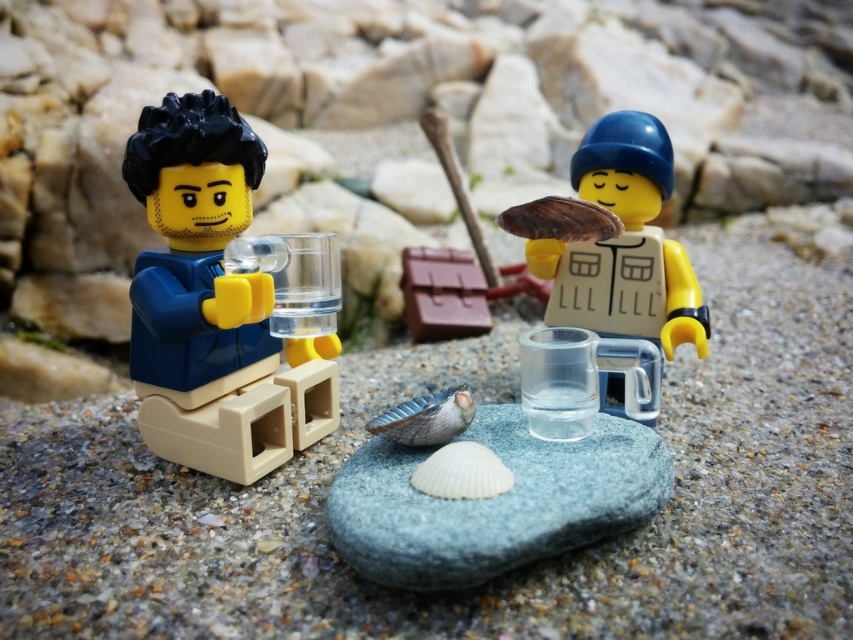
You are a LEGO minifigure trying to determine which object is bigger between the matte blue shirt at left and the smooth gray rock at center. Based on the scene, which one is larger?

The matte blue shirt at left is larger in size than the smooth gray rock at center.

You are a LEGO minifigure trying to reach the translucent plastic mug at center without stepping on the smooth gray rock at center. Can you walk directly between them?

The smooth gray rock at center is closer to the viewer than the translucent plastic mug at center, so you can walk directly between them as the rock is in front and the mug is behind.

You are a LEGO minifigure trying to reach the translucent plastic mug at center. You are currently standing next to the matte blue shirt at left. Which direction should you move to get to the mug?

The matte blue shirt at left is positioned under the translucent plastic mug at center, so you should move upward to reach the mug.